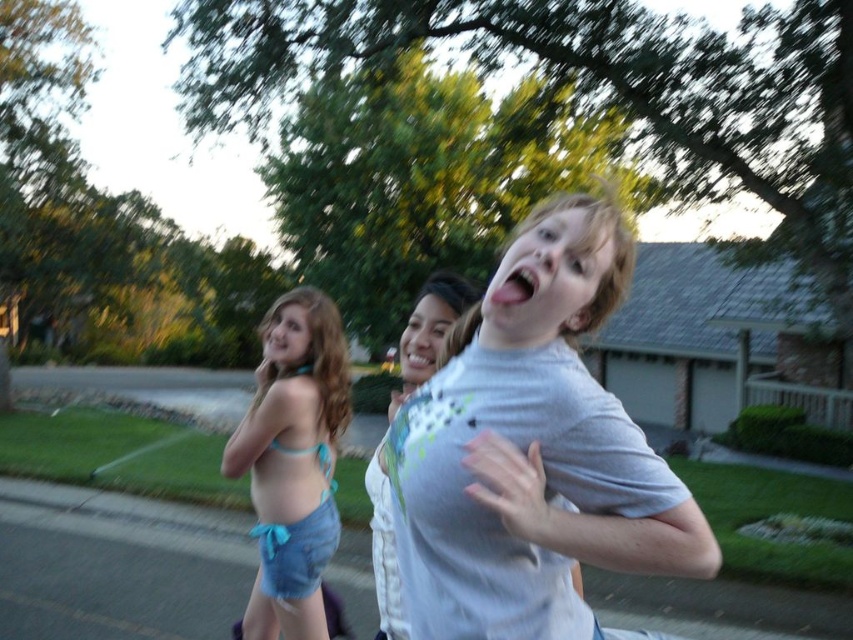
You are standing at the origin point of the coordinate system in this scene. You see two points marked in the image. Which point, point (500, 515) or point (270, 356), is closer to you?

Point (500, 515) is in front of point (270, 356), so it is closer to you.

Looking at this image, you are standing on the sidewalk and see the denim shorts at left and the white textured shirt at center. Which one is higher up in the image?

The denim shorts at left is above the white textured shirt at center in the image.